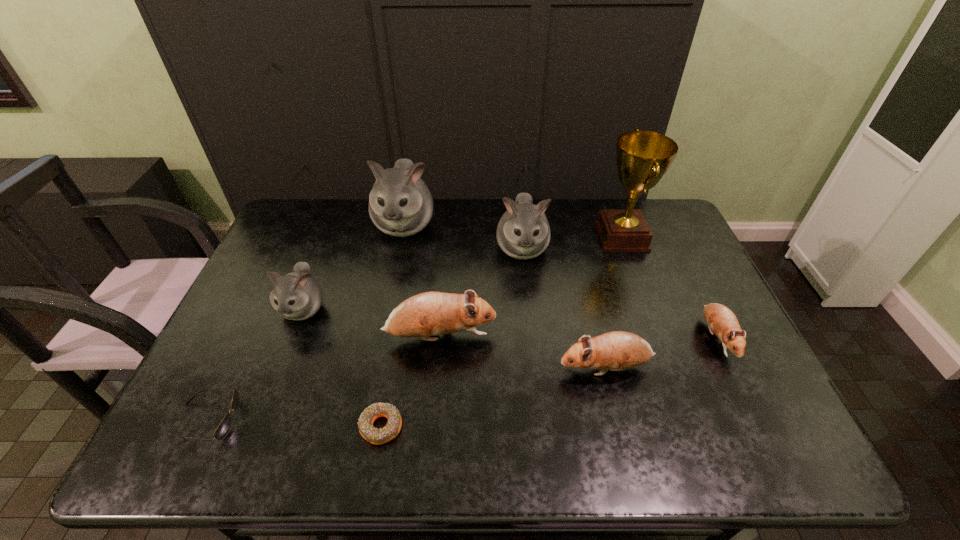
This screenshot has width=960, height=540. In order to click on the fifth tallest hamster in this screenshot , I will do `click(618, 350)`.

Identify the location of the rightmost object. (721, 320).

Where is `the third shortest object`? The height and width of the screenshot is (540, 960). the third shortest object is located at coordinates tap(721, 320).

Where is `the eighth tallest object`? the eighth tallest object is located at coordinates (223, 429).

At what (x,y) coordinates should I click in order to perform the action: click on doughnut. Please return your answer as a coordinate pair (x, y). Looking at the image, I should click on (376, 436).

Find the location of a particular element. The image size is (960, 540). the shortest object is located at coordinates (376, 436).

Locate an element on the screen. The width and height of the screenshot is (960, 540). free space located 0.270m on the plaque of the tallest object is located at coordinates (516, 237).

You are a GUI agent. You are given a task and a screenshot of the screen. Output one action in this format:
    pyautogui.click(x=<x>, y=<y>)
    Task: Click on the vacant space situated 0.370m on the plaque of the tallest object
    The image size is (960, 540).
    Given the screenshot: What is the action you would take?
    pyautogui.click(x=487, y=237)

Locate an element on the screen. Image resolution: width=960 pixels, height=540 pixels. vacant space located on the plaque of the tallest object is located at coordinates pyautogui.click(x=570, y=237).

Locate an element on the screen. The width and height of the screenshot is (960, 540). free location located on the face of the tallest hamster is located at coordinates (389, 302).